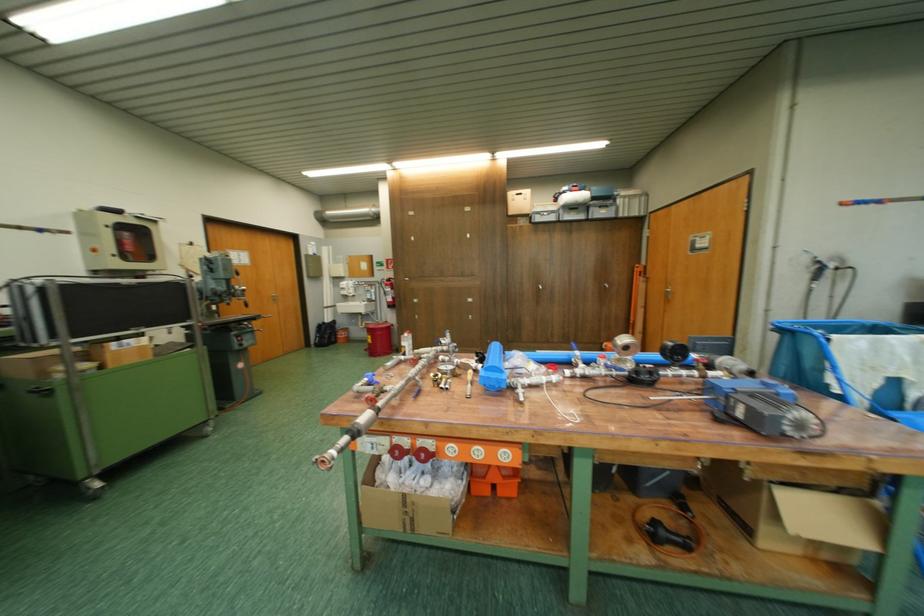
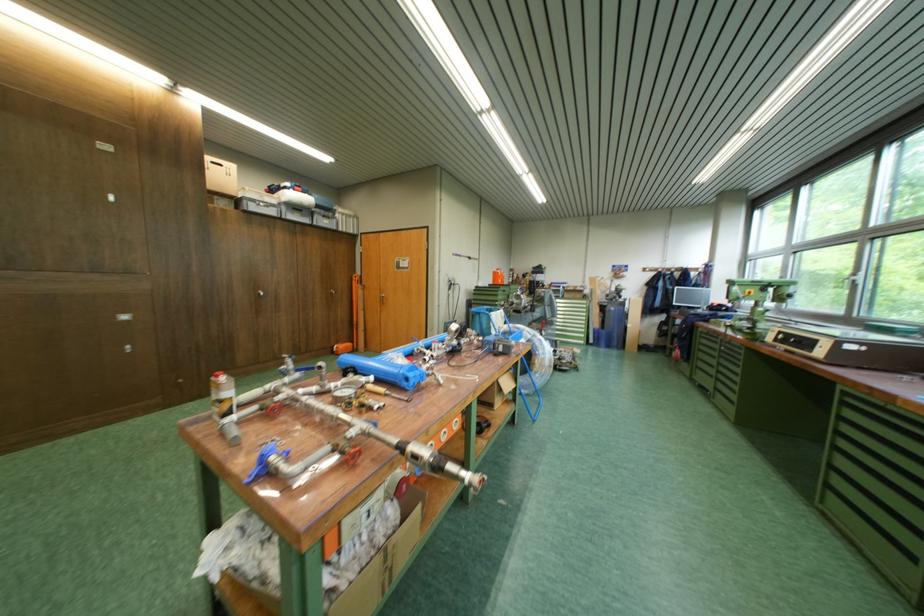
Find the pixel in the second image that matches the point at 478,302 in the first image.

(127, 321)